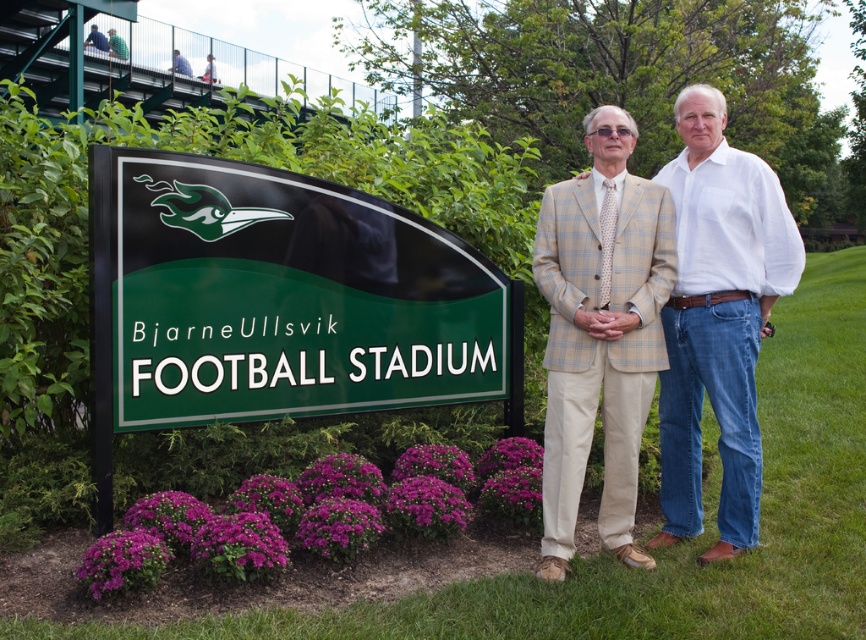
Between beige plaid blazer at center and blue shirt at upper left, which one appears on the left side from the viewer's perspective?

From the viewer's perspective, blue shirt at upper left appears more on the left side.

Which of these two, beige plaid blazer at center or blue shirt at upper left, stands taller?

beige plaid blazer at center

Does point (664, 400) come closer to viewer compared to point (181, 54)?

Yes, it is in front of point (181, 54).

Image resolution: width=866 pixels, height=640 pixels. Identify the location of beige plaid blazer at center. (709, 316).

Where is `green glossy sign at lower left`? The image size is (866, 640). green glossy sign at lower left is located at coordinates (283, 300).

Is green glossy sign at lower left positioned in front of blue shirt at upper left?

Yes, green glossy sign at lower left is in front of blue shirt at upper left.

This screenshot has width=866, height=640. What do you see at coordinates (283, 300) in the screenshot? I see `green glossy sign at lower left` at bounding box center [283, 300].

At what (x,y) coordinates should I click in order to perform the action: click on green glossy sign at lower left. Please return your answer as a coordinate pair (x, y). Image resolution: width=866 pixels, height=640 pixels. Looking at the image, I should click on (283, 300).

Between point (154, 376) and point (625, 148), which one is positioned behind?

Positioned behind is point (154, 376).

Which is in front, point (309, 205) or point (740, 428)?

Point (740, 428) is more forward.

Where is `green glossy sign at lower left`? This screenshot has width=866, height=640. green glossy sign at lower left is located at coordinates (283, 300).